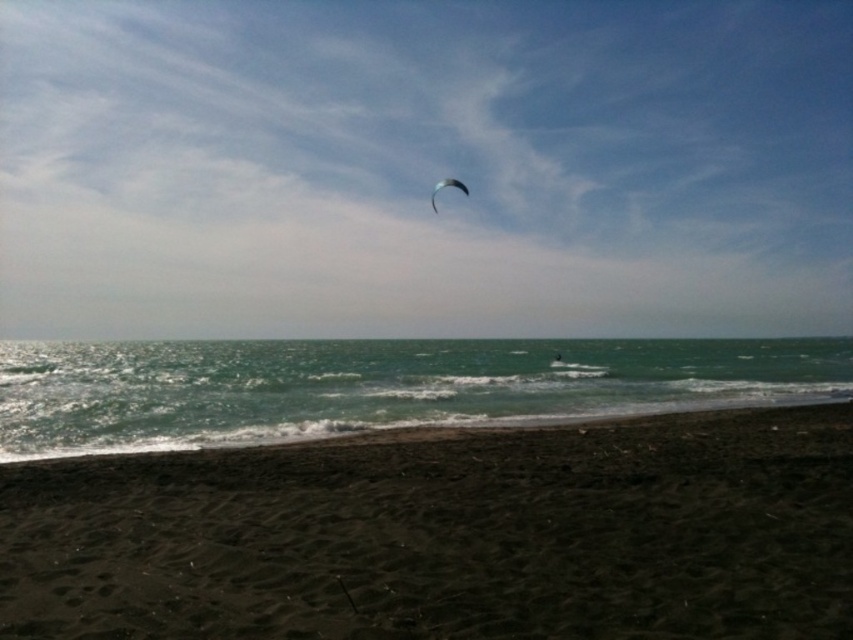
You are standing on the beach looking towards the ocean. You see a point marked at coordinates (424, 168). What object is located at that point?

The transparent blue kite at upper center is located at the point marked by coordinates (424, 168).

You are standing on the beach looking at the scene. There is a point marked at coordinates (424, 168). What object is located at that point?

The point at (424, 168) indicates the location of the transparent blue kite at upper center.